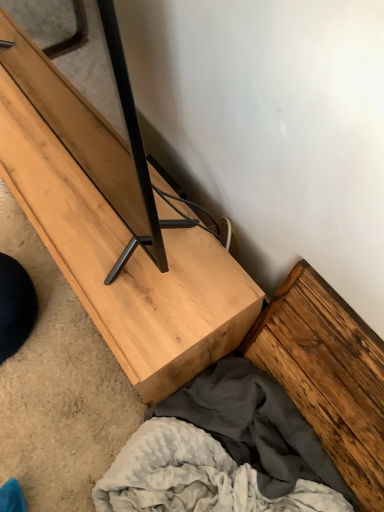
Locate an element on the screen. blank area beneath black matte wood plank at center, arranged as the first plank when viewed from the left (from a real-world perspective) is located at coordinates click(x=61, y=163).